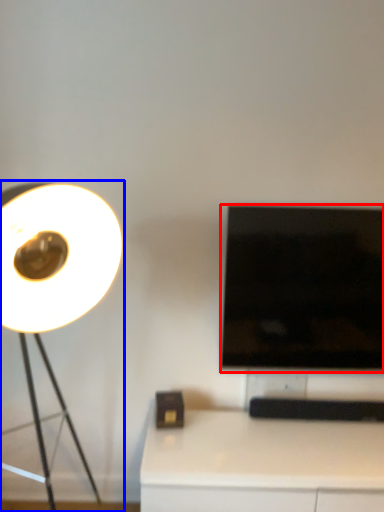
Question: Which point is closer to the camera, television (highlighted by a red box) or lamp (highlighted by a blue box)?

Choices:
 (A) television
 (B) lamp

Answer: (B)